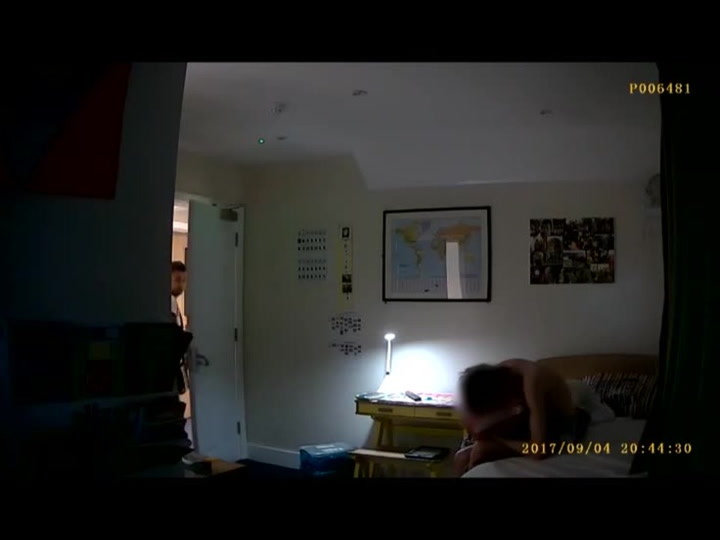
Image resolution: width=720 pixels, height=540 pixels. Find the location of `lamp`. lamp is located at coordinates (389, 348).